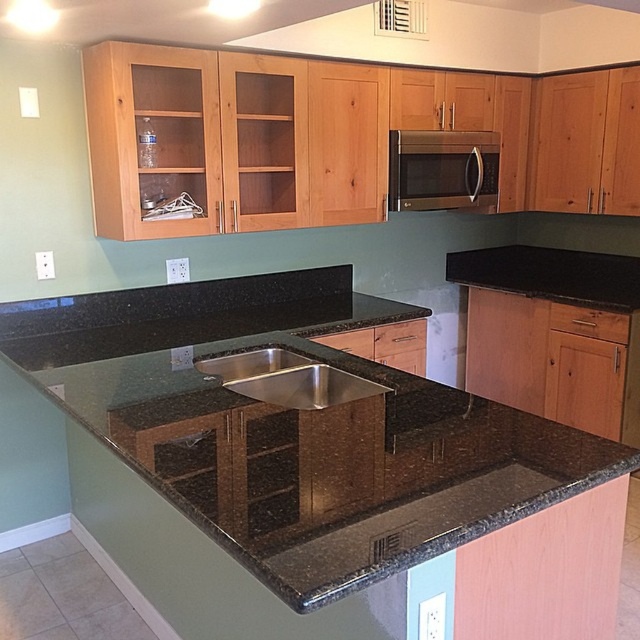
Between satin stainless steel microwave at upper center and stainless steel sink at center, which one has more height?

satin stainless steel microwave at upper center is taller.

You are a GUI agent. You are given a task and a screenshot of the screen. Output one action in this format:
    pyautogui.click(x=<x>, y=<y>)
    Task: Click on the satin stainless steel microwave at upper center
    This screenshot has height=640, width=640.
    Given the screenshot: What is the action you would take?
    pyautogui.click(x=442, y=170)

The image size is (640, 640). What are the coordinates of `satin stainless steel microwave at upper center` in the screenshot? It's located at (442, 170).

Can you confirm if black granite countertop at center is positioned above satin stainless steel microwave at upper center?

Actually, black granite countertop at center is below satin stainless steel microwave at upper center.

Is point (378, 412) positioned in front of point (390, 198)?

Yes, point (378, 412) is in front of point (390, 198).

Find the location of a particular element. This screenshot has height=640, width=640. black granite countertop at center is located at coordinates (296, 428).

Who is higher up, black granite countertop at center or stainless steel sink at center?

black granite countertop at center is above.

Which is below, black granite countertop at center or stainless steel sink at center?

Positioned lower is stainless steel sink at center.

What do you see at coordinates (296, 428) in the screenshot?
I see `black granite countertop at center` at bounding box center [296, 428].

I want to click on black granite countertop at center, so click(x=296, y=428).